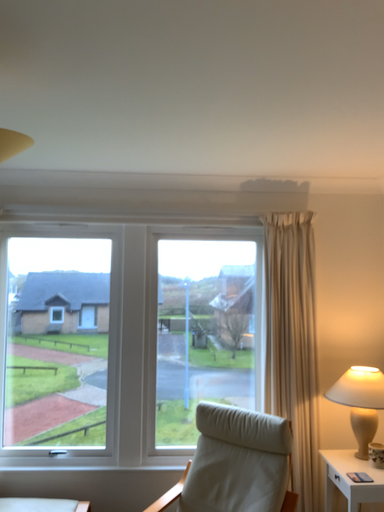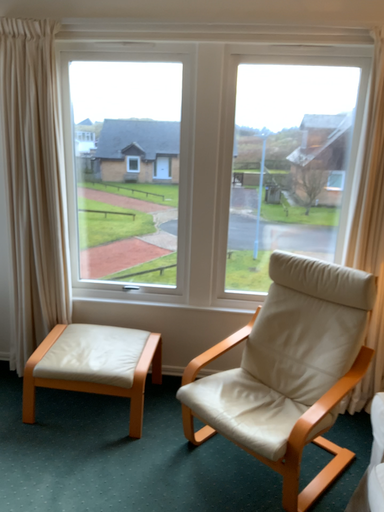
Question: Which way did the camera rotate in the video?

Choices:
 (A) rotated upward
 (B) rotated downward

Answer: (B)